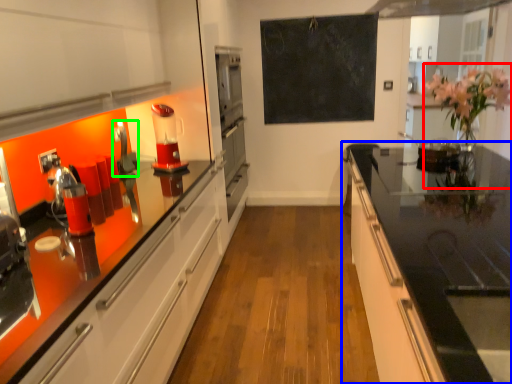
Question: Based on their relative distances, which object is nearer to floral arrangement (highlighted by a red box)? Choose from countertop (highlighted by a blue box) and appliance (highlighted by a green box).

Choices:
 (A) countertop
 (B) appliance

Answer: (A)